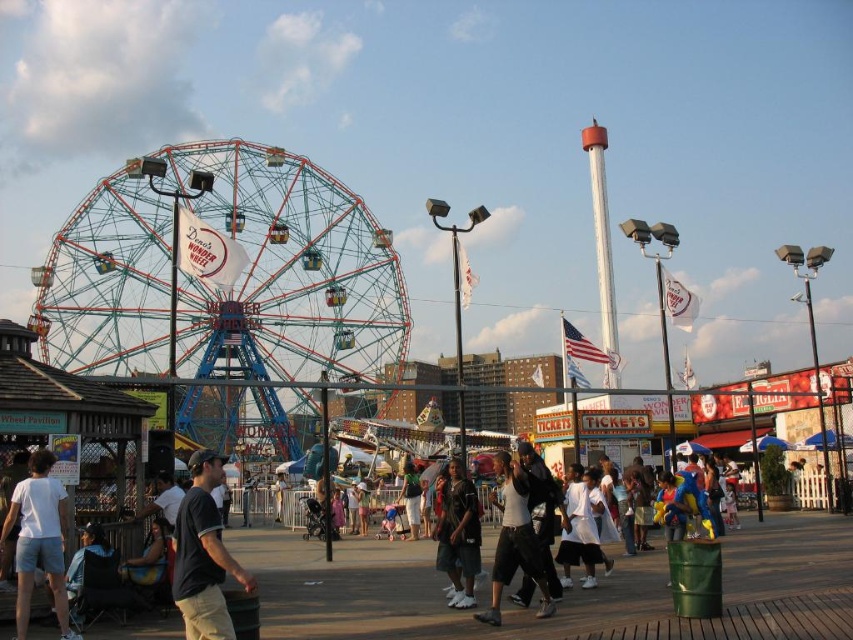
Which is behind, point (200, 540) or point (448, 477)?

Point (448, 477)

Consider the image. Who is taller, dark blue cotton shirt at center or dark blue jeans at center?

With more height is dark blue cotton shirt at center.

Where is `dark blue cotton shirt at center`? dark blue cotton shirt at center is located at coordinates (202, 554).

Does white cotton shirt at lower left have a larger size compared to dark blue jeans at center?

Yes, white cotton shirt at lower left is bigger than dark blue jeans at center.

Is point (51, 524) in front of point (440, 499)?

Yes, it is in front of point (440, 499).

Find the location of a particular element. white cotton shirt at lower left is located at coordinates (38, 540).

At what (x,y) coordinates should I click in order to perform the action: click on white cotton shirt at lower left. Please return your answer as a coordinate pair (x, y). Looking at the image, I should click on (38, 540).

Between white cotton shirt at lower left and dark gray pants at center, which one has more height?

With more height is white cotton shirt at lower left.

Locate an element on the screen. The width and height of the screenshot is (853, 640). white cotton shirt at lower left is located at coordinates (38, 540).